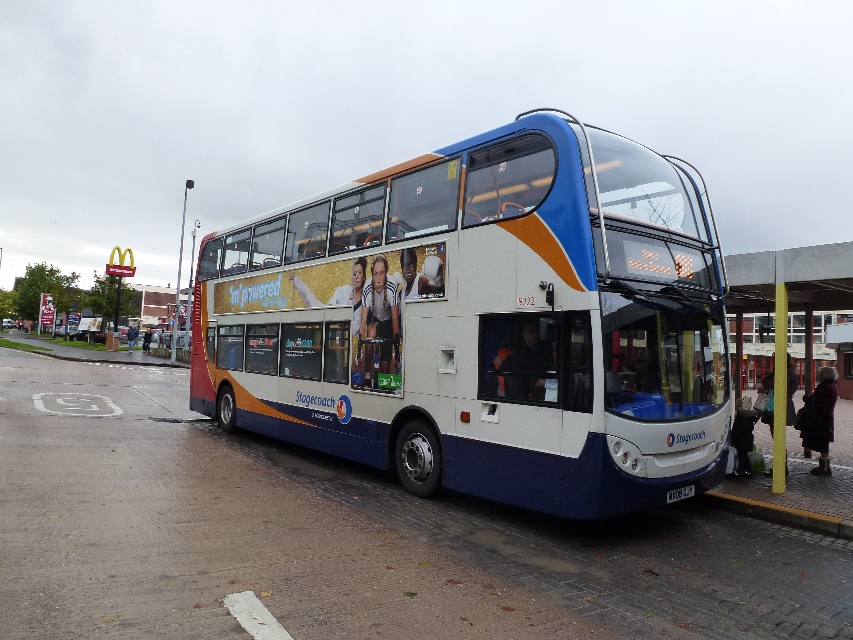
Is white glossy decker bus at center positioned before white plastic license plate at lower center?

Yes, white glossy decker bus at center is in front of white plastic license plate at lower center.

Is white glossy decker bus at center below white plastic license plate at lower center?

Incorrect, white glossy decker bus at center is not positioned below white plastic license plate at lower center.

Does point (695, 321) come in front of point (686, 484)?

No, (695, 321) is behind (686, 484).

At what (x,y) coordinates should I click in order to perform the action: click on white glossy decker bus at center. Please return your answer as a coordinate pair (x, y). The width and height of the screenshot is (853, 640). Looking at the image, I should click on coord(485,323).